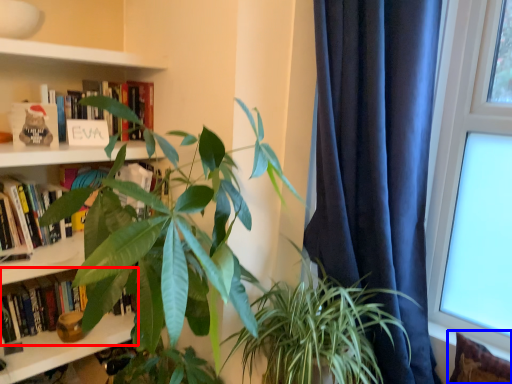
Question: Which object appears farthest to the camera in this image, book (highlighted by a red box) or pillow (highlighted by a blue box)?

Choices:
 (A) book
 (B) pillow

Answer: (A)